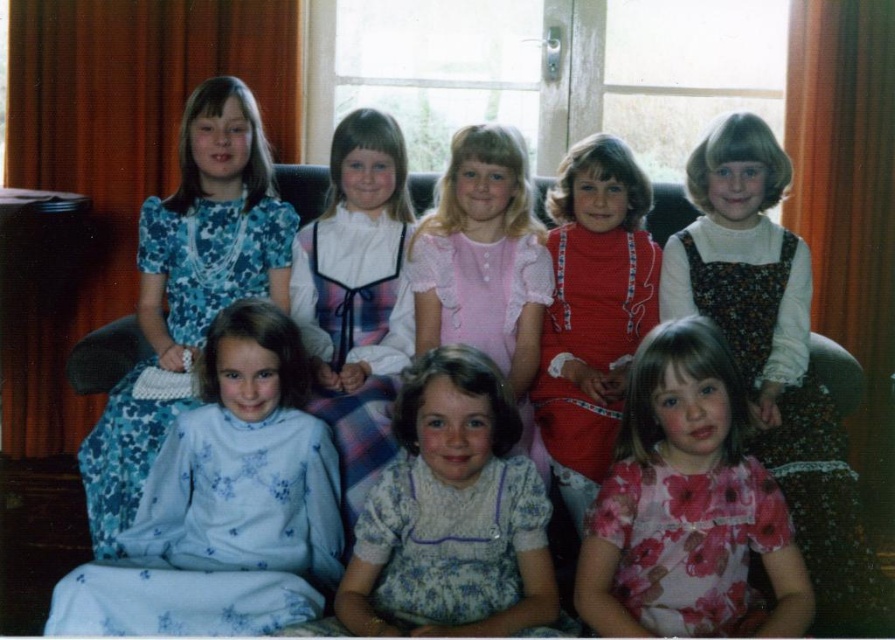
Question: Can you confirm if white satin dress at center is smaller than flannel fabric couch at center?

Choices:
 (A) no
 (B) yes

Answer: (A)

Question: Can you confirm if floral cotton dress at lower right is positioned above red knit dress at center?

Choices:
 (A) yes
 (B) no

Answer: (B)

Question: Does floral cotton dress at lower right have a greater width compared to flannel fabric couch at center?

Choices:
 (A) no
 (B) yes

Answer: (B)

Question: Which object is positioned farthest from the floral cotton dress at left?

Choices:
 (A) floral fabric dress at lower center
 (B) floral cotton dress at lower right

Answer: (B)

Question: Which object is the farthest from the floral fabric dress at lower center?

Choices:
 (A) red knit dress at center
 (B) white satin dress at center

Answer: (B)

Question: Which of the following is the farthest from the observer?

Choices:
 (A) floral fabric dress at lower center
 (B) floral cotton dress at left
 (C) floral pajamas at lower left

Answer: (B)